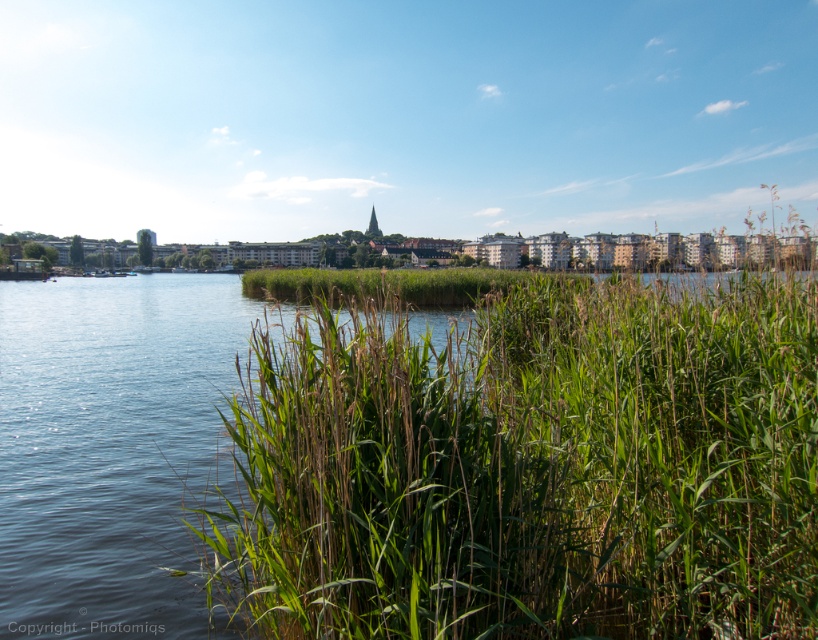
Question: Where is green leafy grass at center located in relation to green grassy river at center in the image?

Choices:
 (A) right
 (B) left

Answer: (A)

Question: Observing the image, what is the correct spatial positioning of green leafy grass at center in reference to green grassy river at center?

Choices:
 (A) left
 (B) right

Answer: (B)

Question: Which object is farther from the camera taking this photo?

Choices:
 (A) green grassy river at center
 (B) green leafy grass at center

Answer: (A)

Question: Which point is closer to the camera?

Choices:
 (A) (3, 634)
 (B) (576, 632)

Answer: (B)

Question: Is green leafy grass at center smaller than green grassy river at center?

Choices:
 (A) no
 (B) yes

Answer: (B)